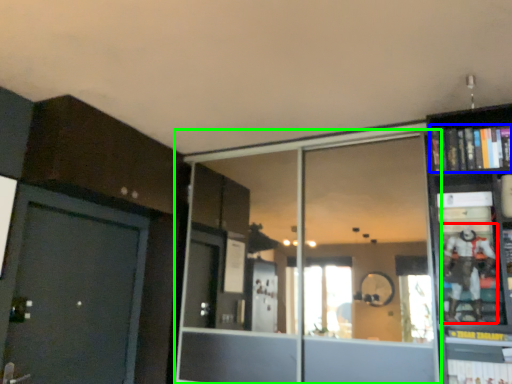
Question: Estimate the real-world distances between objects in this image. Which object is farther from toy (highlighted by a red box), book (highlighted by a blue box) or glass door (highlighted by a green box)?

Choices:
 (A) book
 (B) glass door

Answer: (B)